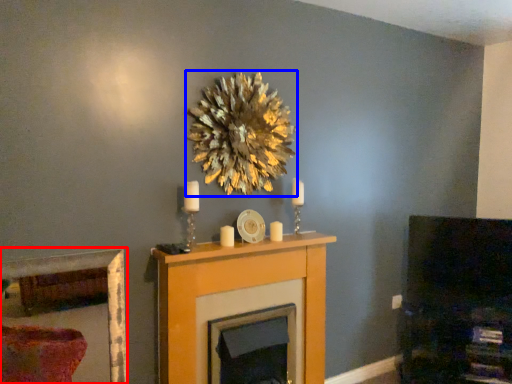
Question: Which object appears farthest to the camera in this image, picture frame (highlighted by a red box) or flower (highlighted by a blue box)?

Choices:
 (A) picture frame
 (B) flower

Answer: (B)